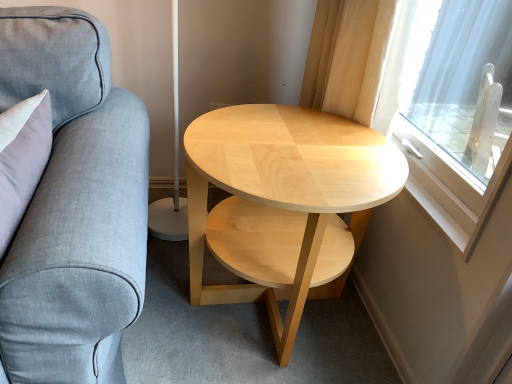
Question: Is natural wood coffee table at center at the left side of gray fabric couch at left?

Choices:
 (A) no
 (B) yes

Answer: (A)

Question: Is natural wood coffee table at center oriented towards gray fabric couch at left?

Choices:
 (A) yes
 (B) no

Answer: (B)

Question: Is natural wood coffee table at center behind gray fabric couch at left?

Choices:
 (A) yes
 (B) no

Answer: (A)

Question: From the image's perspective, is natural wood coffee table at center under gray fabric couch at left?

Choices:
 (A) no
 (B) yes

Answer: (A)

Question: Considering the relative sizes of natural wood coffee table at center and gray fabric couch at left in the image provided, is natural wood coffee table at center wider than gray fabric couch at left?

Choices:
 (A) no
 (B) yes

Answer: (B)

Question: Is the depth of natural wood coffee table at center less than that of gray fabric couch at left?

Choices:
 (A) yes
 (B) no

Answer: (B)

Question: Does gray fabric couch at left have a greater height compared to natural wood coffee table at center?

Choices:
 (A) yes
 (B) no

Answer: (A)

Question: Considering the relative sizes of gray fabric couch at left and natural wood coffee table at center in the image provided, is gray fabric couch at left bigger than natural wood coffee table at center?

Choices:
 (A) no
 (B) yes

Answer: (A)

Question: From the image's perspective, is gray fabric couch at left above natural wood coffee table at center?

Choices:
 (A) yes
 (B) no

Answer: (B)

Question: Can you confirm if gray fabric couch at left is smaller than natural wood coffee table at center?

Choices:
 (A) no
 (B) yes

Answer: (B)

Question: Does gray fabric couch at left have a lesser height compared to natural wood coffee table at center?

Choices:
 (A) yes
 (B) no

Answer: (B)

Question: Could you tell me if gray fabric couch at left is turned towards natural wood coffee table at center?

Choices:
 (A) yes
 (B) no

Answer: (B)

Question: From the image's perspective, is transparent glass window at right located beneath gray fabric couch at left?

Choices:
 (A) yes
 (B) no

Answer: (B)